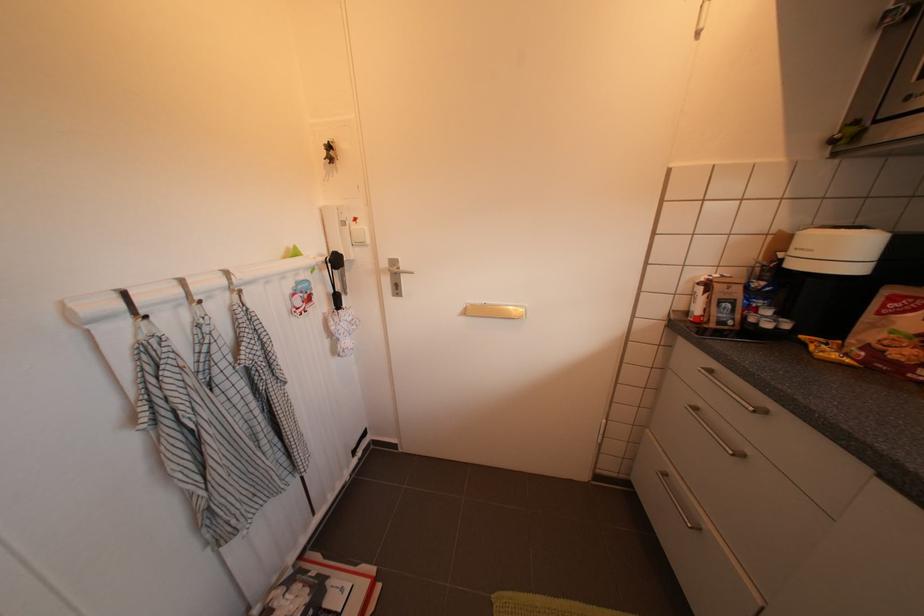
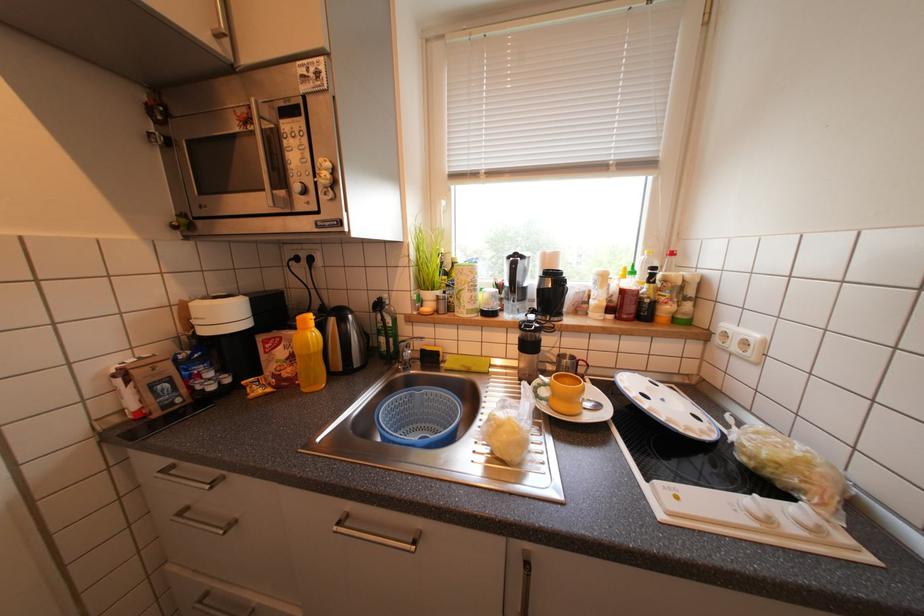
Question: The camera is either moving clockwise (left) or counter-clockwise (right) around the object. The first image is from the beginning of the video and the second image is from the end. Is the camera moving left or right when shooting the video?

Choices:
 (A) Left
 (B) Right

Answer: (A)